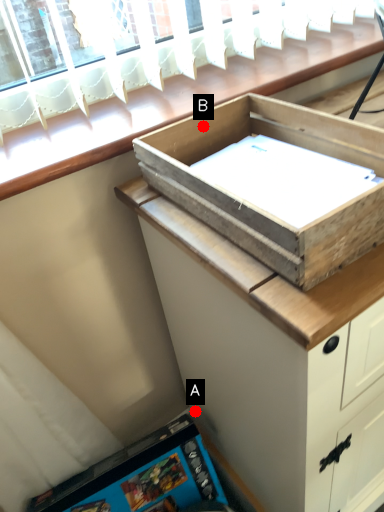
Question: Two points are circled on the image, labeled by A and B beside each circle. Which point is further to the camera?

Choices:
 (A) A is further
 (B) B is further

Answer: (A)